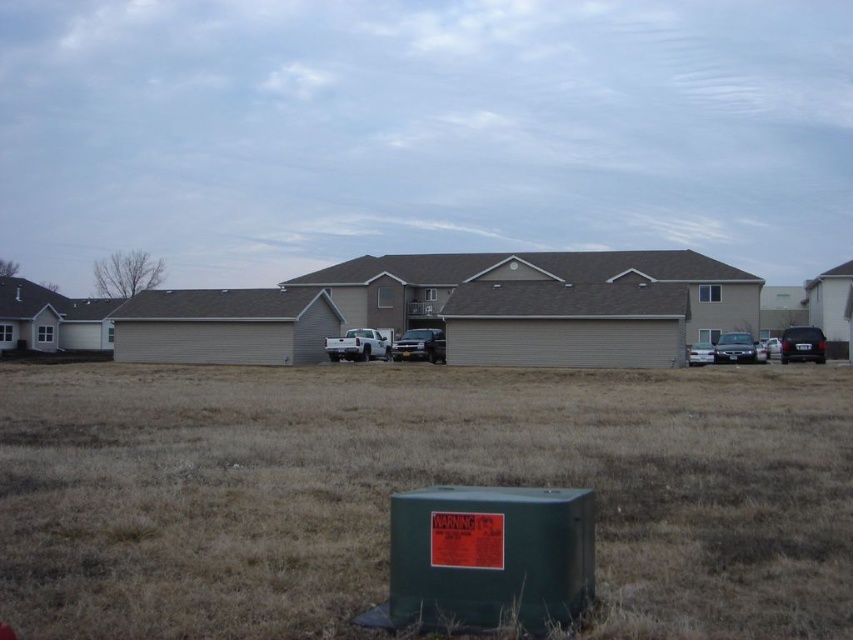
You are a delivery person approaching the house and need to park the satin black sedan at right. Where should you park it so that the brown dry grass at lower center is visible from the driver seat?

The satin black sedan at right should be parked behind the brown dry grass at lower center so that the grass is in front of the car, making it visible from the driver seat.

You are a delivery driver who needs to park your delivery van between the metallic silver truck at center and the shiny black sedan at right. The van is 2.5 meters wide. Can you fit your van between them?

The metallic silver truck at center has a lesser width compared to shiny black sedan at right. Since the truck is narrower than the sedan, the space between them might be sufficient for the van. However, without knowing the exact distance between the vehicles, it is uncertain if the 2.5 meter wide van can fit.

You are a delivery driver who needs to park your delivery van between the metallic silver truck at center and the shiny black sedan at right. The van requires 20 feet of space to park. Is there enough space between them?

The metallic silver truck at center and shiny black sedan at right are 63.42 feet apart. Since the van needs 20 feet of space, there is sufficient space between them for parking.